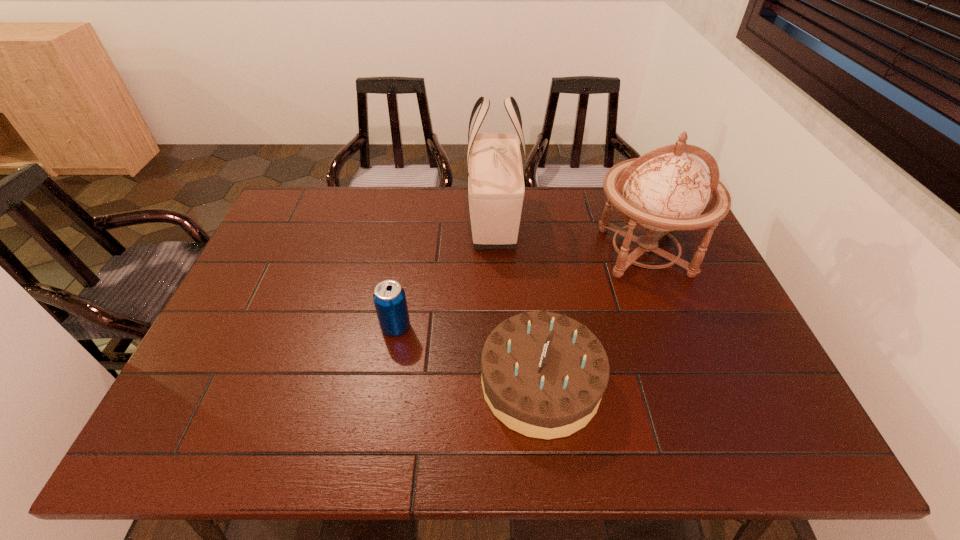
Locate an element on the screen. This screenshot has height=540, width=960. object that stands as the closest to the birthday cake is located at coordinates (666, 189).

This screenshot has width=960, height=540. Identify the location of the second closest object to the rightmost object. (496, 188).